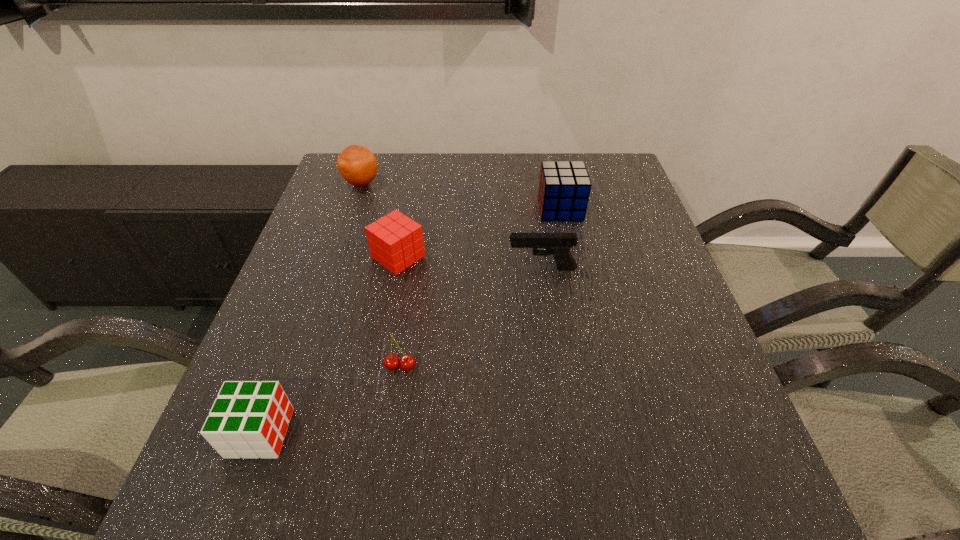
Find the location of a particular element. vacant area that lies between the tallest cube and the orange is located at coordinates (461, 195).

Where is `vacant area that lies between the pistol and the second farthest cube`? vacant area that lies between the pistol and the second farthest cube is located at coordinates (470, 262).

The height and width of the screenshot is (540, 960). In order to click on vacant space that's between the cherry and the second farthest cube in this screenshot , I will do `click(399, 312)`.

Locate an element on the screen. Image resolution: width=960 pixels, height=540 pixels. free spot between the fifth farthest object and the pistol is located at coordinates (471, 318).

What are the coordinates of `vacant space in between the second nearest object and the second nearest cube` in the screenshot? It's located at [x=399, y=312].

Find the location of a particular element. Image resolution: width=960 pixels, height=540 pixels. object that is the second closest to the fifth nearest object is located at coordinates (395, 241).

Where is `the fourth closest object to the cherry`? the fourth closest object to the cherry is located at coordinates (564, 188).

Locate an element on the screen. The height and width of the screenshot is (540, 960). cube that can be found as the third closest to the pistol is located at coordinates (249, 419).

Identify the location of cube that stands as the second closest to the second farthest object. (249, 419).

Identify the location of free space that satisfies the following two spatial constraints: 1. with the stems of the cherry pointing upwards; 2. on the red face of the nearest cube. (391, 433).